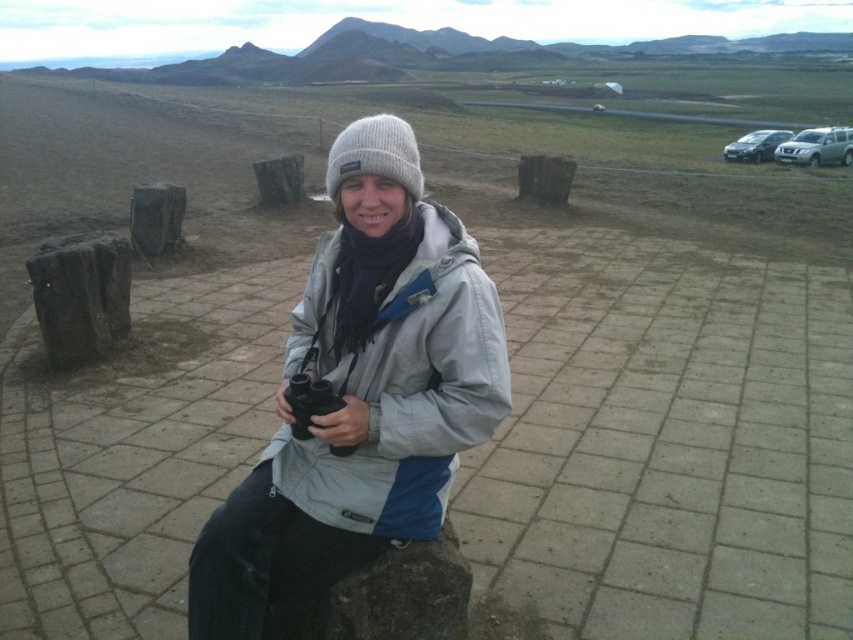
You are the person in the scene holding the black rubber binoculars at center. You want to put them down on the paved area next to the satin silver sedan at upper right. Is the binoculars currently closer to the sedan than the paved area?

The black rubber binoculars at center is in front of the satin silver sedan at upper right, so the binoculars are closer to the sedan than the paved area.

You are a photographer trying to capture a closeup of the gray fleece jacket at center and the black rubber binoculars at center. If your camera has a depth of field that can focus on objects within 6 inches, will both items be in focus?

The gray fleece jacket at center is 6.62 inches from the black rubber binoculars at center. Since the depth of field can focus within 6 inches, the distance between them exceeds this range, so both items may not be in focus simultaneously.

You are the person in the scene holding the black rubber binoculars at center. You want to place them on the satin silver sedan at upper right. Which side of the sedan should you place them so they are closest to the direction you were facing while holding the binoculars?

The black rubber binoculars at center is to the left of the satin silver sedan at upper right, so placing them on the left side of the sedan would keep them closest to the direction you were facing while holding the binoculars.